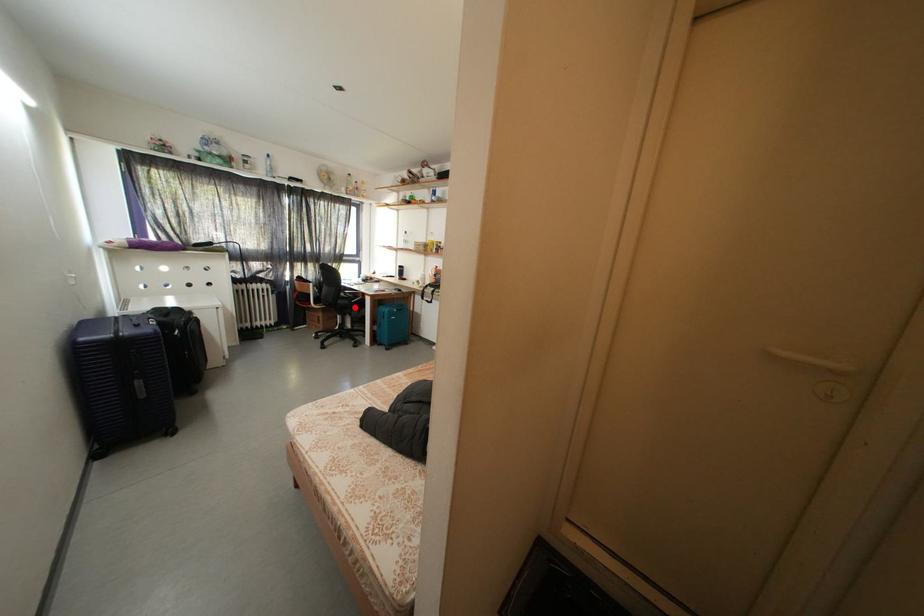
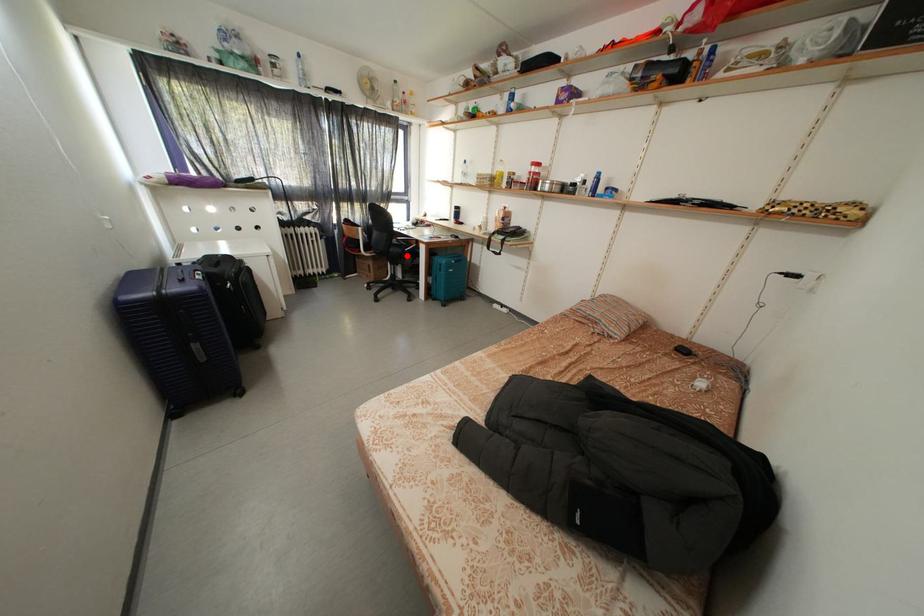
I am providing you with two images of the same scene from different viewpoints. A red point is marked on the first image and another point is marked on the second image. Do the highlighted points in image1 and image2 indicate the same real-world spot?

Yes